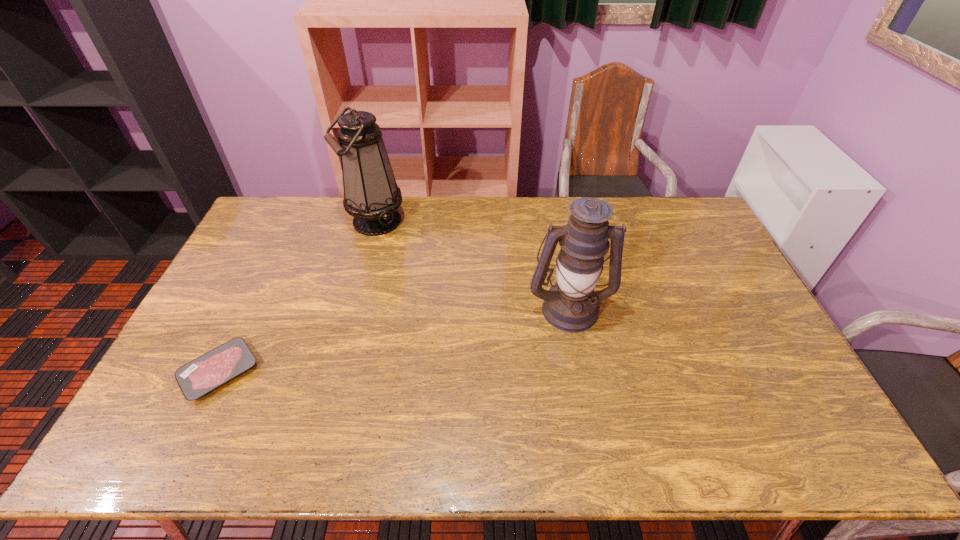
At what (x,y) coordinates should I click in order to perform the action: click on object at the left edge. Please return your answer as a coordinate pair (x, y). Image resolution: width=960 pixels, height=540 pixels. Looking at the image, I should click on (197, 378).

Where is `free location at the far edge`? The image size is (960, 540). free location at the far edge is located at coordinates (462, 200).

Locate an element on the screen. vacant space at the near edge of the desktop is located at coordinates (345, 450).

This screenshot has width=960, height=540. In the image, there is a desktop. Find the location of `vacant space at the left edge`. vacant space at the left edge is located at coordinates (202, 419).

At what (x,y) coordinates should I click in order to perform the action: click on vacant space at the right edge. Please return your answer as a coordinate pair (x, y). Looking at the image, I should click on (741, 390).

This screenshot has height=540, width=960. In the image, there is a desktop. In order to click on vacant space at the far left corner in this screenshot , I will do `click(261, 233)`.

In the image, there is a desktop. At what (x,y) coordinates should I click in order to perform the action: click on blank space at the near right corner. Please return your answer as a coordinate pair (x, y). This screenshot has width=960, height=540. Looking at the image, I should click on (764, 443).

The width and height of the screenshot is (960, 540). What are the coordinates of `vacant area that lies between the shortest object and the farther oil lamp` in the screenshot? It's located at (298, 296).

At what (x,y) coordinates should I click in order to perform the action: click on vacant region between the steak and the rightmost object. Please return your answer as a coordinate pair (x, y). This screenshot has width=960, height=540. Looking at the image, I should click on (395, 340).

Where is `blank region between the steak and the farther oil lamp`? The height and width of the screenshot is (540, 960). blank region between the steak and the farther oil lamp is located at coordinates (298, 296).